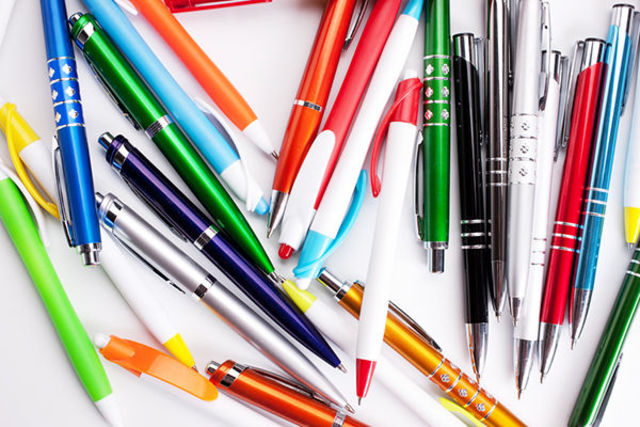
Where is `pens wiith red`? pens wiith red is located at coordinates (188, 3), (362, 64), (410, 96), (570, 168), (320, 55), (275, 395).